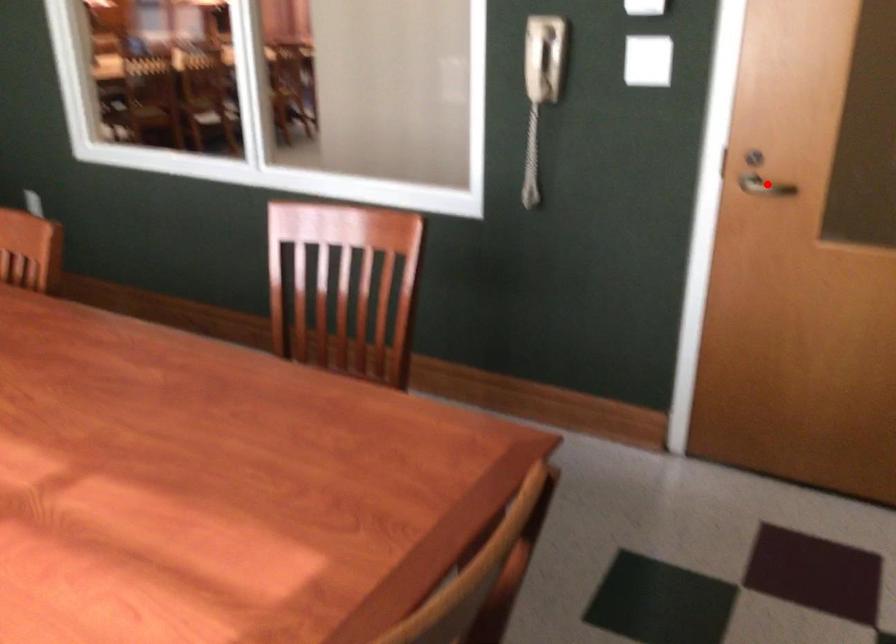
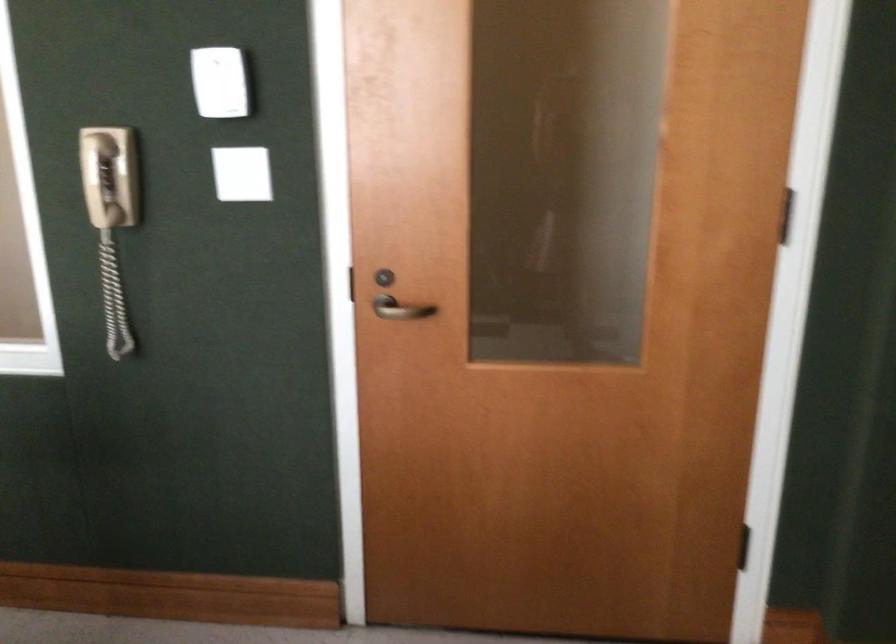
The point at the highlighted location is marked in the first image. Where is the corresponding point in the second image?

(401, 308)